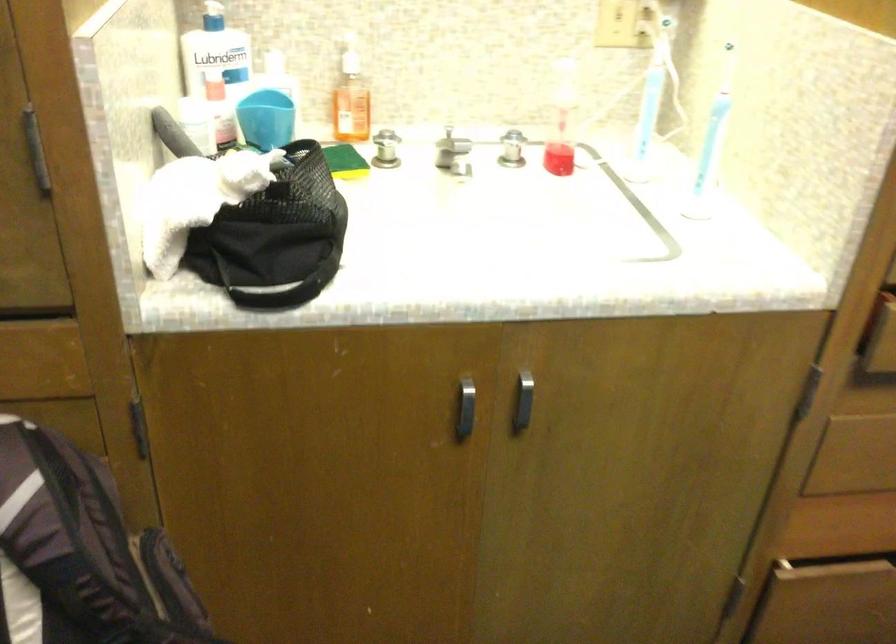
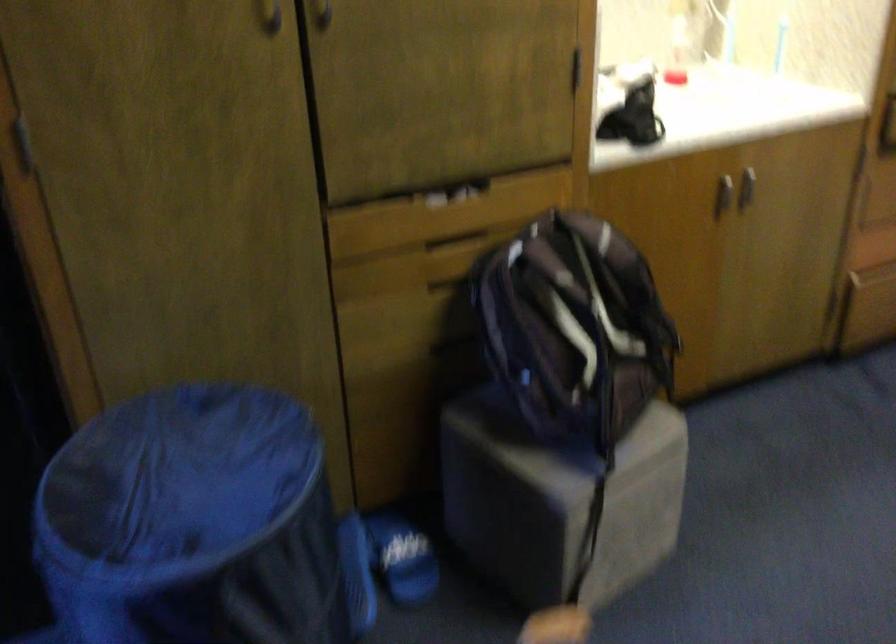
Question: I am providing you with two images of the same scene from different viewpoints. Which of the following objects are not visible in image2?

Choices:
 (A) recessed drawer handle
 (B) silver faucet knob
 (C) drawer lip handle
 (D) silver cabinet handle

Answer: (B)